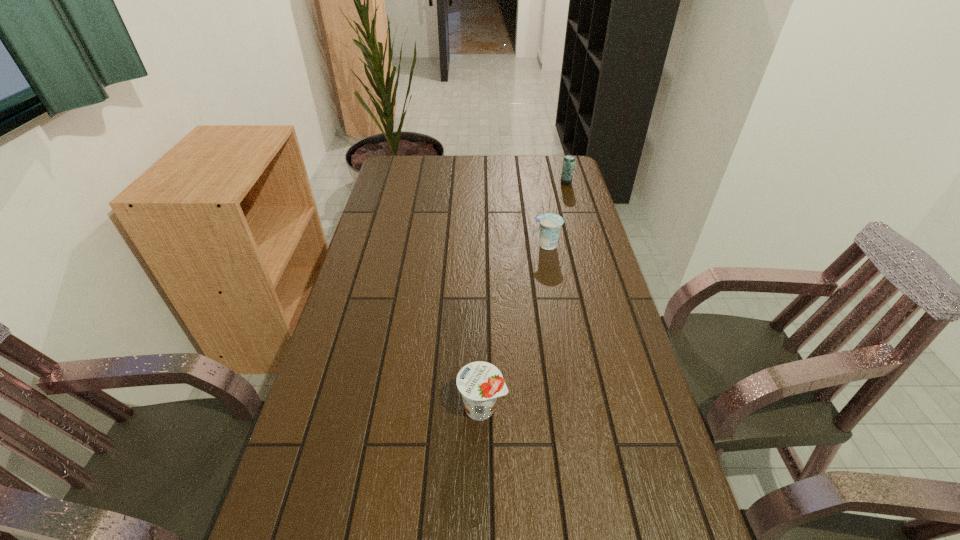
The height and width of the screenshot is (540, 960). Identify the location of beer can. (x=569, y=161).

Locate an element on the screen. This screenshot has height=540, width=960. the rightmost object is located at coordinates (569, 161).

Identify the location of the nearer yogurt. (480, 383).

This screenshot has height=540, width=960. In order to click on the left yogurt in this screenshot , I will do `click(480, 383)`.

The height and width of the screenshot is (540, 960). Find the location of `the second farthest object`. the second farthest object is located at coordinates (550, 224).

At what (x,y) coordinates should I click in order to perform the action: click on the farther yogurt. Please return your answer as a coordinate pair (x, y). This screenshot has width=960, height=540. Looking at the image, I should click on (550, 224).

Find the location of a particular element. The image size is (960, 540). blank area located 0.330m on the front of the farthest object is located at coordinates (581, 235).

Where is `vacant space located on the left of the left yogurt`? vacant space located on the left of the left yogurt is located at coordinates (384, 408).

Where is `vacant space located 0.320m on the front of the second farthest object`? The height and width of the screenshot is (540, 960). vacant space located 0.320m on the front of the second farthest object is located at coordinates (561, 326).

You are a GUI agent. You are given a task and a screenshot of the screen. Output one action in this format:
    pyautogui.click(x=<x>, y=<y>)
    Task: Click on the object located at the far edge
    Image resolution: width=960 pixels, height=540 pixels.
    Given the screenshot: What is the action you would take?
    pyautogui.click(x=569, y=161)